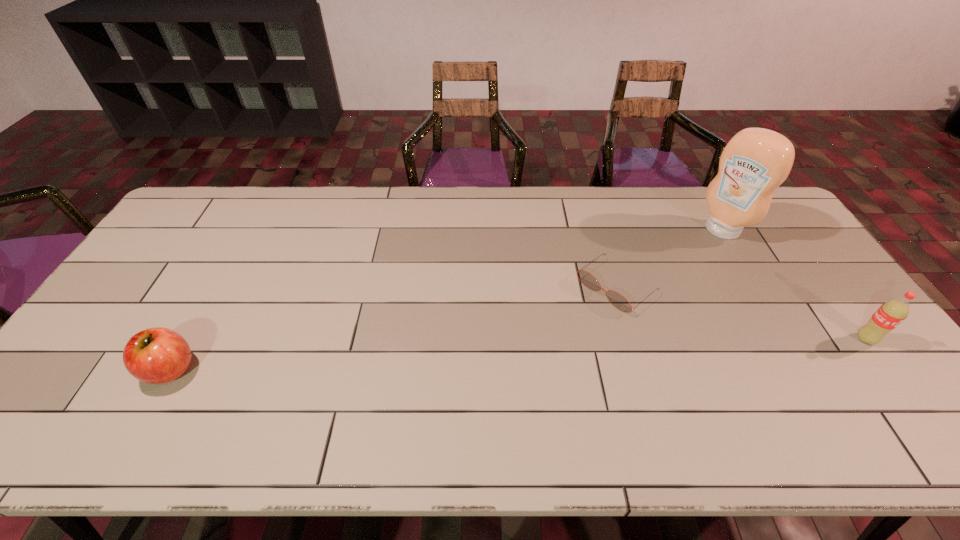
At what (x,y) coordinates should I click in order to perform the action: click on free location located 0.120m on the label of the farthest object. Please return your answer as a coordinate pair (x, y). Looking at the image, I should click on coord(688,257).

This screenshot has height=540, width=960. What are the coordinates of `free space located 0.110m on the label of the farthest object` in the screenshot? It's located at (690, 255).

At what (x,y) coordinates should I click in order to perform the action: click on vacant space situated 0.190m on the label of the farthest object. Please return your answer as a coordinate pair (x, y). Image resolution: width=960 pixels, height=540 pixels. Looking at the image, I should click on click(676, 267).

The image size is (960, 540). I want to click on vacant space positioned on the face of the shortest object, so click(526, 357).

In order to click on vacant region located 0.360m on the face of the shortest object in this screenshot , I will do `click(497, 380)`.

Locate an element on the screen. This screenshot has width=960, height=540. vacant point located on the face of the shortest object is located at coordinates (485, 389).

Identify the location of object located at the far edge. The width and height of the screenshot is (960, 540). (756, 161).

Locate an element on the screen. The image size is (960, 540). object that is at the near edge is located at coordinates (158, 355).

Locate an element on the screen. The width and height of the screenshot is (960, 540). soda present at the right edge is located at coordinates [890, 314].

The width and height of the screenshot is (960, 540). Identify the location of condiment that is positioned at the right edge. (756, 161).